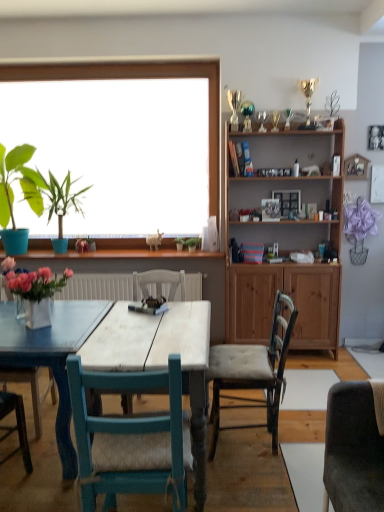
Question: Is wooden cabinet at upper right with pink matte flower at window?

Choices:
 (A) yes
 (B) no

Answer: (B)

Question: Does wooden cabinet at upper right have a lesser height compared to pink matte flower at window?

Choices:
 (A) yes
 (B) no

Answer: (B)

Question: Does wooden cabinet at upper right have a greater height compared to pink matte flower at window?

Choices:
 (A) yes
 (B) no

Answer: (A)

Question: Can you confirm if wooden cabinet at upper right is thinner than pink matte flower at window?

Choices:
 (A) no
 (B) yes

Answer: (A)

Question: Does wooden cabinet at upper right come behind pink matte flower at window?

Choices:
 (A) no
 (B) yes

Answer: (A)

Question: From the image's perspective, relative to white glossy vase at left, is tufted fabric chair at center, the second chair in the left-to-right sequence, above or below?

Choices:
 (A) below
 (B) above

Answer: (A)

Question: Is tufted fabric chair at center, which is the first chair from back to front, wider or thinner than white glossy vase at left?

Choices:
 (A) wide
 (B) thin

Answer: (A)

Question: Based on their sizes in the image, would you say tufted fabric chair at center, which is the first chair from back to front, is bigger or smaller than white glossy vase at left?

Choices:
 (A) small
 (B) big

Answer: (B)

Question: Considering their positions, is tufted fabric chair at center, the second chair in the left-to-right sequence, located in front of or behind white glossy vase at left?

Choices:
 (A) behind
 (B) front

Answer: (A)

Question: From the image's perspective, relative to wooden picture frame at upper center, is white wood table at center above or below?

Choices:
 (A) below
 (B) above

Answer: (A)

Question: Based on their positions, is white wood table at center located to the left or right of wooden picture frame at upper center?

Choices:
 (A) right
 (B) left

Answer: (B)

Question: Which is correct: white wood table at center is inside wooden picture frame at upper center, or outside of it?

Choices:
 (A) outside
 (B) inside

Answer: (A)

Question: In terms of size, does white wood table at center appear bigger or smaller than wooden picture frame at upper center?

Choices:
 (A) small
 (B) big

Answer: (B)

Question: From a real-world perspective, is wooden cabinet at upper right positioned above or below pink matte flower at window?

Choices:
 (A) above
 (B) below

Answer: (A)

Question: In terms of size, does wooden cabinet at upper right appear bigger or smaller than pink matte flower at window?

Choices:
 (A) small
 (B) big

Answer: (B)